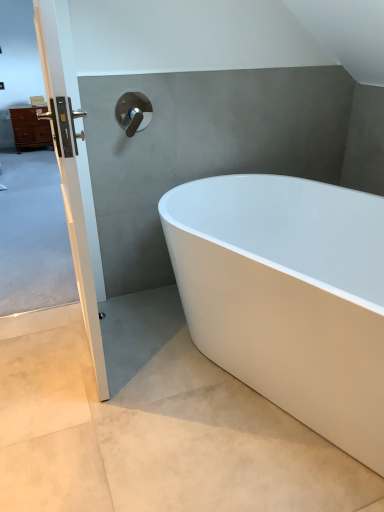
Question: Looking at their shapes, would you say white glossy bathtub at center is wider or thinner than white smooth concrete at lower right?

Choices:
 (A) wide
 (B) thin

Answer: (B)

Question: Which is correct: white glossy bathtub at center is inside white smooth concrete at lower right, or outside of it?

Choices:
 (A) inside
 (B) outside

Answer: (B)

Question: Which is farther from the white glossy bathtub at center?

Choices:
 (A) white smooth concrete at lower right
 (B) matte brown chest of drawers at left
 (C) white glossy door handle at left
 (D) polished chrome faucet at upper center

Answer: (B)

Question: Which object is positioned closest to the polished chrome faucet at upper center?

Choices:
 (A) white glossy bathtub at center
 (B) white smooth concrete at lower right
 (C) matte brown chest of drawers at left
 (D) white glossy door handle at left

Answer: (D)